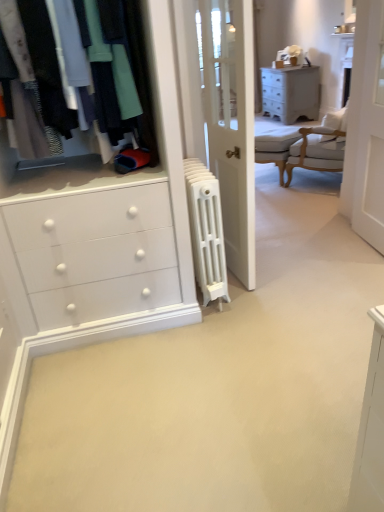
Locate an element on the screen. The width and height of the screenshot is (384, 512). white upholstered chair at upper right is located at coordinates (320, 145).

Where is `matte black clothing at upper left`? The image size is (384, 512). matte black clothing at upper left is located at coordinates point(131,77).

Is point (215, 251) in front of point (112, 2)?

No, (215, 251) is further to viewer.

From the picture: From the image's perspective, is white cast iron radiator at center positioned above or below matte black clothing at upper left?

white cast iron radiator at center is situated lower than matte black clothing at upper left in the image.

Identify the location of closet that appears on the left of white cast iron radiator at center. The width and height of the screenshot is (384, 512). (131, 77).

Considering the positions of objects white cast iron radiator at center and matte black clothing at upper left in the image provided, who is more to the right, white cast iron radiator at center or matte black clothing at upper left?

white cast iron radiator at center.

From a real-world perspective, is white wood screen door at upper right below white cast iron radiator at center?

No.

Is white cast iron radiator at center at the back of white wood screen door at upper right?

That's not correct — white wood screen door at upper right is not looking away from white cast iron radiator at center.

Can you confirm if white wood screen door at upper right is shorter than white cast iron radiator at center?

No.

Which of these two, white wood screen door at upper right or white cast iron radiator at center, is wider?

With larger width is white cast iron radiator at center.

Does matte gray chest of drawers at upper right come behind white wood screen door at upper right?

That is True.

Does matte gray chest of drawers at upper right contain white wood screen door at upper right?

Definitely not — white wood screen door at upper right is not inside matte gray chest of drawers at upper right.

Between matte gray chest of drawers at upper right and white wood screen door at upper right, which one has smaller size?

Smaller between the two is white wood screen door at upper right.

Based on their positions, is matte gray chest of drawers at upper right located to the left or right of white wood screen door at upper right?

matte gray chest of drawers at upper right is to the right of white wood screen door at upper right.

From a real-world perspective, which object stands above the other?

From a 3D spatial view, white wood screen door at upper right is above.

Between white cast iron radiator at center and white wood screen door at upper right, which one has larger width?

white cast iron radiator at center is wider.

Consider the image. Can you confirm if white cast iron radiator at center is smaller than white wood screen door at upper right?

Correct, white cast iron radiator at center occupies less space than white wood screen door at upper right.

Can you see white cast iron radiator at center touching white wood screen door at upper right?

white cast iron radiator at center and white wood screen door at upper right are not in contact.

Would you consider matte black clothing at upper left to be distant from light gray fabric armchair at center?

Yes, matte black clothing at upper left is far from light gray fabric armchair at center.

Which is behind, matte black clothing at upper left or light gray fabric armchair at center?

light gray fabric armchair at center is more distant.

Could you tell me if matte black clothing at upper left is facing light gray fabric armchair at center?

No.

From a real-world perspective, is matte black clothing at upper left beneath light gray fabric armchair at center?

Actually, matte black clothing at upper left is physically above light gray fabric armchair at center in the real world.

From the image's perspective, which one is positioned lower, white cast iron radiator at center or matte gray chest of drawers at upper right?

white cast iron radiator at center is shown below in the image.

Which of these two, white cast iron radiator at center or matte gray chest of drawers at upper right, is thinner?

matte gray chest of drawers at upper right.

Looking at this image, from a real-world perspective, is white cast iron radiator at center beneath matte gray chest of drawers at upper right?

No, from a real-world perspective, white cast iron radiator at center is not below matte gray chest of drawers at upper right.

Is matte gray chest of drawers at upper right located within white cast iron radiator at center?

No, matte gray chest of drawers at upper right is not inside white cast iron radiator at center.

Does white upholstered chair at upper right turn towards matte gray chest of drawers at upper right?

No, white upholstered chair at upper right is not facing towards matte gray chest of drawers at upper right.

Between white upholstered chair at upper right and matte gray chest of drawers at upper right, which one has more height?

white upholstered chair at upper right.

Is white upholstered chair at upper right surrounding matte gray chest of drawers at upper right?

No, matte gray chest of drawers at upper right is located outside of white upholstered chair at upper right.

Locate an element on the screen. The height and width of the screenshot is (512, 384). radiator behind the matte black clothing at upper left is located at coordinates (206, 231).

The image size is (384, 512). In order to click on radiator below the white wood screen door at upper right (from a real-world perspective) in this screenshot , I will do `click(206, 231)`.

Based on the photo, from the image, which object appears to be nearer to white wood screen door at upper right, white cast iron radiator at center or matte gray chest of drawers at upper right?

white cast iron radiator at center is positioned closer to the anchor white wood screen door at upper right.

Based on their spatial positions, is light gray fabric armchair at center or white wood screen door at upper right closer to matte black clothing at upper left?

white wood screen door at upper right.

When comparing their distances from matte black clothing at upper left, does white wood screen door at upper right or white cast iron radiator at center seem closer?

Based on the image, white cast iron radiator at center appears to be nearer to matte black clothing at upper left.

From the image, which object appears to be nearer to white wood screen door at upper right, matte black clothing at upper left or white upholstered chair at upper right?

Among the two, white upholstered chair at upper right is located nearer to white wood screen door at upper right.

Looking at the image, which one is located closer to white cast iron radiator at center, matte black clothing at upper left or white upholstered chair at upper right?

Based on the image, matte black clothing at upper left appears to be nearer to white cast iron radiator at center.

Estimate the real-world distances between objects in this image. Which object is further from white cast iron radiator at center, matte gray chest of drawers at upper right or white upholstered chair at upper right?

matte gray chest of drawers at upper right.

From the picture: Based on their spatial positions, is light gray fabric armchair at center or white cast iron radiator at center further from white wood screen door at upper right?

Based on the image, light gray fabric armchair at center appears to be further to white wood screen door at upper right.

From the image, which object appears to be nearer to matte gray chest of drawers at upper right, white upholstered chair at upper right or white wood screen door at upper right?

white upholstered chair at upper right is positioned closer to the anchor matte gray chest of drawers at upper right.

I want to click on chair between matte black clothing at upper left and light gray fabric armchair at center along the z-axis, so (x=320, y=145).

The width and height of the screenshot is (384, 512). I want to click on armchair between white cast iron radiator at center and matte gray chest of drawers at upper right from front to back, so click(276, 147).

Where is `chair positioned between white wood screen door at upper right and matte gray chest of drawers at upper right from near to far`? chair positioned between white wood screen door at upper right and matte gray chest of drawers at upper right from near to far is located at coordinates (320, 145).

Image resolution: width=384 pixels, height=512 pixels. What are the coordinates of `radiator between matte black clothing at upper left and light gray fabric armchair at center in the front-back direction` in the screenshot? It's located at (206, 231).